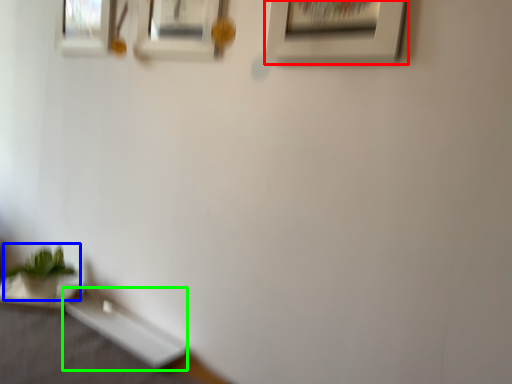
Question: Which object is positioned closest to picture frame (highlighted by a red box)? Select from houseplant (highlighted by a blue box) and table (highlighted by a green box).

Choices:
 (A) houseplant
 (B) table

Answer: (B)